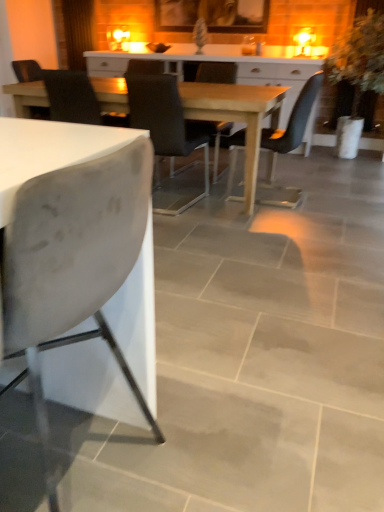
What do you see at coordinates (76, 99) in the screenshot? This screenshot has height=512, width=384. I see `velvet black chair at center, which is counted as the 2th chair, starting from the back` at bounding box center [76, 99].

This screenshot has width=384, height=512. Describe the element at coordinates (166, 135) in the screenshot. I see `matte black chair at center, arranged as the 4th chair when viewed from the back` at that location.

Looking at this image, what is the approximate height of white matte chair at left, which ranks as the 5th chair in back-to-front order?

37.06 inches.

This screenshot has height=512, width=384. What do you see at coordinates (291, 125) in the screenshot?
I see `matte black chair at center, the third chair in the front-to-back sequence` at bounding box center [291, 125].

In order to click on matte black chair at center, which is the 3th chair from back to front in this screenshot , I will do `click(291, 125)`.

What do you see at coordinates (236, 116) in the screenshot? I see `wooden table at center` at bounding box center [236, 116].

Where is `velvet black chair at center, placed as the 4th chair when sorted from front to back`? This screenshot has width=384, height=512. velvet black chair at center, placed as the 4th chair when sorted from front to back is located at coordinates (76, 99).

Does matte black chair at center, arranged as the 4th chair when viewed from the back, turn towards velvet black chair at center, placed as the 4th chair when sorted from front to back?

No, matte black chair at center, arranged as the 4th chair when viewed from the back, is not turned towards velvet black chair at center, placed as the 4th chair when sorted from front to back.

From the image's perspective, between matte black chair at center, arranged as the 4th chair when viewed from the back, and velvet black chair at center, which is counted as the 2th chair, starting from the back, which one is located above?

From the image's view, velvet black chair at center, which is counted as the 2th chair, starting from the back, is above.

From a real-world perspective, between matte black chair at center, arranged as the 4th chair when viewed from the back, and velvet black chair at center, placed as the 4th chair when sorted from front to back, who is vertically lower?

matte black chair at center, arranged as the 4th chair when viewed from the back.

In the scene shown: How different are the orientations of green leafy plant at right and wooden table at center in degrees?

93.2 degrees separate the facing orientations of green leafy plant at right and wooden table at center.

Is green leafy plant at right directly adjacent to wooden table at center?

There is a gap between green leafy plant at right and wooden table at center.

Would you say green leafy plant at right contains wooden table at center?

No, wooden table at center is not a part of green leafy plant at right.

Based on their sizes in the image, would you say green leafy plant at right is bigger or smaller than wooden table at center?

Clearly, green leafy plant at right is smaller in size than wooden table at center.

From the image's perspective, is matte black chair at center, the third chair in the front-to-back sequence, below green leafy plant at right?

Yes, from the image's perspective, matte black chair at center, the third chair in the front-to-back sequence, is beneath green leafy plant at right.

Is matte black chair at center, which is the 3th chair from back to front, located outside green leafy plant at right?

Absolutely, matte black chair at center, which is the 3th chair from back to front, is external to green leafy plant at right.

Could you tell me if matte black chair at center, which is the 3th chair from back to front, is facing green leafy plant at right?

No, matte black chair at center, which is the 3th chair from back to front, does not turn towards green leafy plant at right.

How many degrees apart are the facing directions of matte black chair at center, which is the 3th chair from back to front, and green leafy plant at right?

The facing directions of matte black chair at center, which is the 3th chair from back to front, and green leafy plant at right are 92.7 degrees apart.

Is green leafy plant at right not near matte black chair at center, arranged as the 4th chair when viewed from the back?

green leafy plant at right is positioned a significant distance from matte black chair at center, arranged as the 4th chair when viewed from the back.

Considering the sizes of objects green leafy plant at right and matte black chair at center, which is counted as the second chair, starting from the front, in the image provided, who is taller, green leafy plant at right or matte black chair at center, which is counted as the second chair, starting from the front,?

green leafy plant at right.

Is matte black chair at center, which is counted as the second chair, starting from the front, at the back of green leafy plant at right?

No, green leafy plant at right's orientation is not away from matte black chair at center, which is counted as the second chair, starting from the front.

Considering the sizes of green leafy plant at right and matte black chair at center, arranged as the 4th chair when viewed from the back, in the image, is green leafy plant at right wider or thinner than matte black chair at center, arranged as the 4th chair when viewed from the back,?

green leafy plant at right is wider than matte black chair at center, arranged as the 4th chair when viewed from the back.

From the image's perspective, is matte black chair at center, which is the 3th chair from back to front, positioned above or below matte black chair at center, which ranks as the fifth chair in front-to-back order?

Clearly, from the image's perspective, matte black chair at center, which is the 3th chair from back to front, is below matte black chair at center, which ranks as the fifth chair in front-to-back order.

Choose the correct answer: Is matte black chair at center, the third chair in the front-to-back sequence, inside matte black chair at center, marked as the 1th chair in a back-to-front arrangement, or outside it?

The correct answer is: outside.

Does matte black chair at center, which is the 3th chair from back to front, have a larger size compared to matte black chair at center, marked as the 1th chair in a back-to-front arrangement?

Indeed, matte black chair at center, which is the 3th chair from back to front, has a larger size compared to matte black chair at center, marked as the 1th chair in a back-to-front arrangement.

Does matte black chair at center, which is the 3th chair from back to front, touch matte black chair at center, which ranks as the fifth chair in front-to-back order?

matte black chair at center, which is the 3th chair from back to front, is not next to matte black chair at center, which ranks as the fifth chair in front-to-back order, and they're not touching.

Is white matte chair at left, the first chair viewed from the front, far from velvet black chair at center, which is counted as the 2th chair, starting from the back?

Absolutely, white matte chair at left, the first chair viewed from the front, is distant from velvet black chair at center, which is counted as the 2th chair, starting from the back.

From the image's perspective, between white matte chair at left, the first chair viewed from the front, and velvet black chair at center, which is counted as the 2th chair, starting from the back, who is located below?

white matte chair at left, the first chair viewed from the front.

From a real-world perspective, which object rests below the other?

From a 3D spatial view, white matte chair at left, which ranks as the 5th chair in back-to-front order, is below.

Is point (70, 283) in front of point (60, 81)?

Yes, it is in front of point (60, 81).

Measure the distance from green leafy plant at right to velvet black chair at center, which is counted as the 2th chair, starting from the back.

green leafy plant at right and velvet black chair at center, which is counted as the 2th chair, starting from the back, are 2.57 meters apart from each other.

In the scene shown: Considering the sizes of objects green leafy plant at right and velvet black chair at center, which is counted as the 2th chair, starting from the back, in the image provided, who is taller, green leafy plant at right or velvet black chair at center, which is counted as the 2th chair, starting from the back,?

With more height is green leafy plant at right.

From a real-world perspective, is green leafy plant at right beneath velvet black chair at center, placed as the 4th chair when sorted from front to back?

No, from a real-world perspective, green leafy plant at right is not below velvet black chair at center, placed as the 4th chair when sorted from front to back.

Would you say green leafy plant at right is to the left or to the right of velvet black chair at center, placed as the 4th chair when sorted from front to back, in the picture?

Clearly, green leafy plant at right is on the right of velvet black chair at center, placed as the 4th chair when sorted from front to back, in the image.

Where is `chair that is the 2nd one when counting leftward from the matte black chair at center, arranged as the 4th chair when viewed from the back`? This screenshot has width=384, height=512. chair that is the 2nd one when counting leftward from the matte black chair at center, arranged as the 4th chair when viewed from the back is located at coordinates (76, 99).

The image size is (384, 512). I want to click on kitchen & dining room table below the green leafy plant at right (from the image's perspective), so click(236, 116).

From the image, which object appears to be farther from matte black chair at center, which is the 3th chair from back to front, green leafy plant at right or velvet black chair at center, placed as the 4th chair when sorted from front to back?

velvet black chair at center, placed as the 4th chair when sorted from front to back, is positioned further to the anchor matte black chair at center, which is the 3th chair from back to front.

Considering their positions, is matte black chair at center, marked as the 1th chair in a back-to-front arrangement, positioned further to matte black chair at center, which is counted as the second chair, starting from the front, than wooden table at center?

Among the two, matte black chair at center, marked as the 1th chair in a back-to-front arrangement, is located further to matte black chair at center, which is counted as the second chair, starting from the front.

Based on their spatial positions, is green leafy plant at right or white matte chair at left, which ranks as the 5th chair in back-to-front order, further from matte black chair at center, marked as the 1th chair in a back-to-front arrangement?

white matte chair at left, which ranks as the 5th chair in back-to-front order, lies further to matte black chair at center, marked as the 1th chair in a back-to-front arrangement, than the other object.

Considering their positions, is white matte chair at left, the first chair viewed from the front, positioned closer to green leafy plant at right than matte black chair at center, which is counted as the second chair, starting from the front?

matte black chair at center, which is counted as the second chair, starting from the front, is closer to green leafy plant at right.

When comparing their distances from matte black chair at center, marked as the 1th chair in a back-to-front arrangement, does white matte chair at left, which ranks as the 5th chair in back-to-front order, or green leafy plant at right seem closer?

green leafy plant at right lies closer to matte black chair at center, marked as the 1th chair in a back-to-front arrangement, than the other object.

Looking at the image, which one is located closer to matte black chair at center, which ranks as the fifth chair in front-to-back order, green leafy plant at right or matte black chair at center, which is counted as the second chair, starting from the front?

matte black chair at center, which is counted as the second chair, starting from the front, is positioned closer to the anchor matte black chair at center, which ranks as the fifth chair in front-to-back order.

From the image, which object appears to be farther from wooden table at center, velvet black chair at center, which is counted as the 2th chair, starting from the back, or green leafy plant at right?

green leafy plant at right is positioned further to the anchor wooden table at center.

Estimate the real-world distances between objects in this image. Which object is further from matte black chair at center, which is the 3th chair from back to front, white matte chair at left, which ranks as the 5th chair in back-to-front order, or wooden table at center?

Among the two, white matte chair at left, which ranks as the 5th chair in back-to-front order, is located further to matte black chair at center, which is the 3th chair from back to front.

Find the location of a particular element. kitchen & dining room table between white matte chair at left, which ranks as the 5th chair in back-to-front order, and green leafy plant at right, along the z-axis is located at coordinates (236, 116).

Find the location of a particular element. This screenshot has width=384, height=512. kitchen & dining room table between velvet black chair at center, which is counted as the 2th chair, starting from the back, and matte black chair at center, which ranks as the fifth chair in front-to-back order is located at coordinates (236, 116).

The height and width of the screenshot is (512, 384). What are the coordinates of `kitchen & dining room table between matte black chair at center, arranged as the 4th chair when viewed from the back, and matte black chair at center, marked as the 1th chair in a back-to-front arrangement, from front to back` in the screenshot? It's located at (236, 116).

Where is `chair between matte black chair at center, marked as the 1th chair in a back-to-front arrangement, and green leafy plant at right, in the horizontal direction`? The image size is (384, 512). chair between matte black chair at center, marked as the 1th chair in a back-to-front arrangement, and green leafy plant at right, in the horizontal direction is located at coordinates (x=291, y=125).